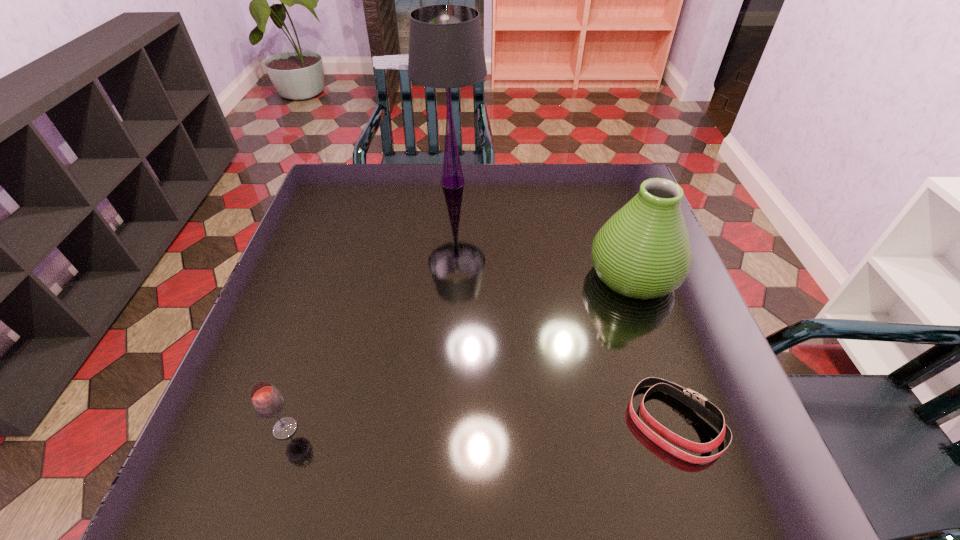
This screenshot has height=540, width=960. I want to click on vacant position located on the back of the shortest object, so click(655, 364).

Where is `object present at the far edge`? object present at the far edge is located at coordinates (x=446, y=50).

Where is `object at the near edge`? object at the near edge is located at coordinates (695, 401).

Identify the location of object that is positioned at the left edge. Image resolution: width=960 pixels, height=540 pixels. (267, 401).

Locate an element on the screen. The image size is (960, 540). vase present at the right edge is located at coordinates (643, 251).

In order to click on dog collar located in the right edge section of the desktop in this screenshot , I will do `click(695, 401)`.

Where is `object that is positioned at the near right corner`? object that is positioned at the near right corner is located at coordinates (695, 401).

You are a GUI agent. You are given a task and a screenshot of the screen. Output one action in this format:
    pyautogui.click(x=<x>, y=<y>)
    Task: Click on the free space at the far edge of the desktop
    The image size is (960, 540).
    Given the screenshot: What is the action you would take?
    pyautogui.click(x=573, y=192)

Where is `vacant space at the near edge`? This screenshot has width=960, height=540. vacant space at the near edge is located at coordinates (577, 471).

Find the location of a particular element. Image resolution: width=960 pixels, height=540 pixels. free region at the left edge is located at coordinates (331, 250).